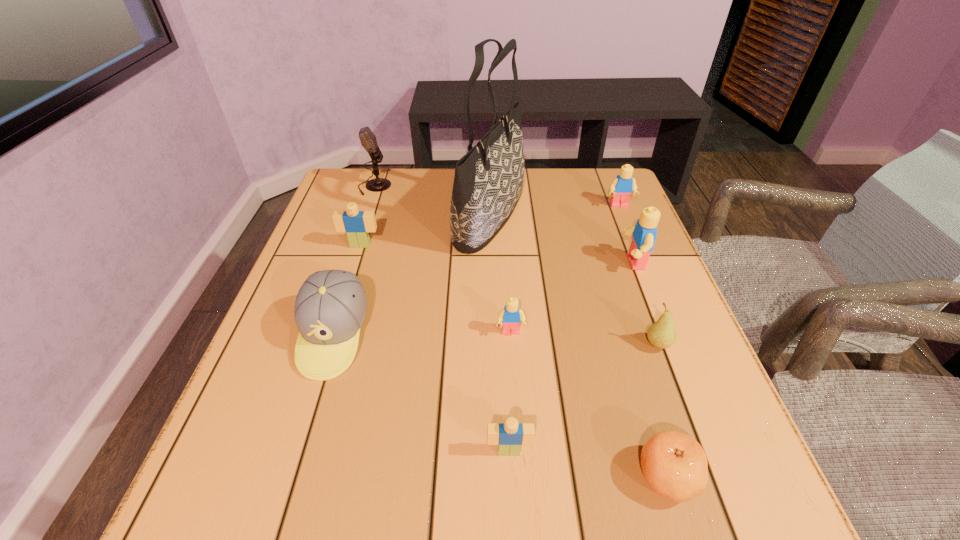
Locate an element on the screen. free space located on the front-facing side of the second farthest yellow Lego is located at coordinates (524, 262).

Locate an element on the screen. vacant space located on the front-facing side of the second farthest yellow Lego is located at coordinates (549, 262).

The width and height of the screenshot is (960, 540). Identify the location of free space located on the face of the left beige Lego. (314, 392).

You are a GUI agent. You are given a task and a screenshot of the screen. Output one action in this format:
    pyautogui.click(x=<x>, y=<y>)
    Task: Click on the free location located 0.060m on the front-facing side of the farthest Lego
    This screenshot has height=540, width=960.
    Given the screenshot: What is the action you would take?
    pyautogui.click(x=626, y=224)

Identify the location of vacant region located on the front-facing side of the baseball cap. This screenshot has height=540, width=960. click(x=276, y=526).

Where is `vacant space situated 0.090m on the left of the pear`? Image resolution: width=960 pixels, height=540 pixels. vacant space situated 0.090m on the left of the pear is located at coordinates (598, 345).

Identify the location of vacant space located 0.170m on the front-facing side of the smallest yellow Lego. The height and width of the screenshot is (540, 960). (516, 417).

In order to click on free space located on the back of the shortest object in this screenshot , I will do tap(638, 382).

Identify the location of tote bag that is positioned at the far edge. (488, 181).

At what (x,y) coordinates should I click in order to perform the action: click on microphone at the far edge. Please return your answer as a coordinate pair (x, y). Image resolution: width=960 pixels, height=540 pixels. Looking at the image, I should click on (368, 140).